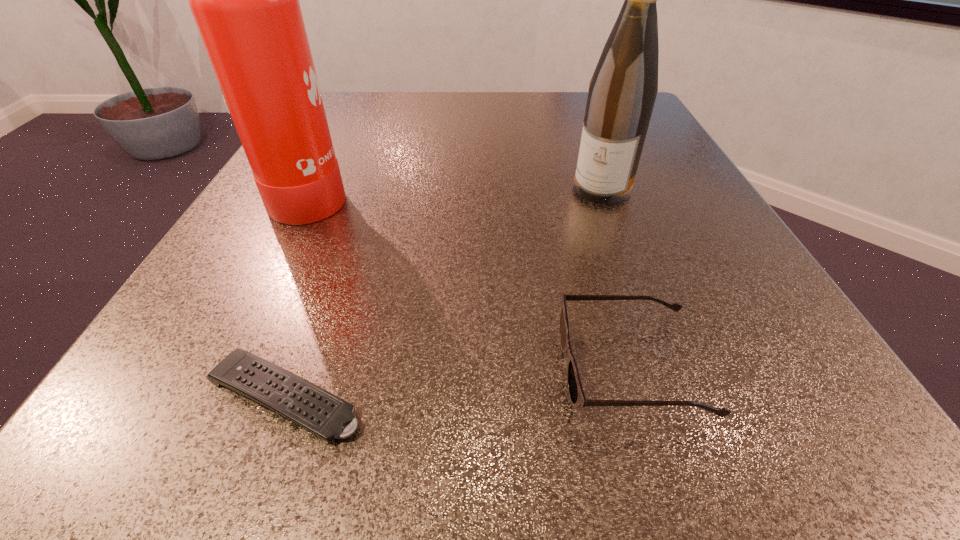
I want to click on vacant region that satisfies the following two spatial constraints: 1. on the back side of the wine bottle; 2. on the right side of the shortest object, so click(x=362, y=188).